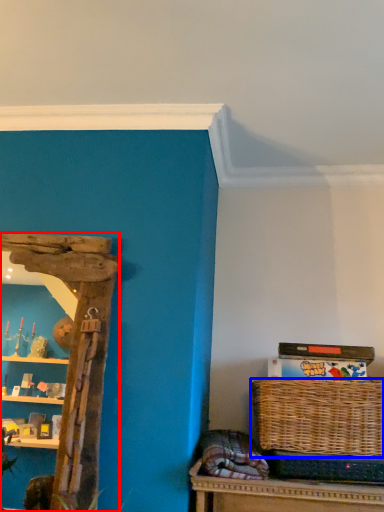
Question: Which of the following is the farthest to the observer, shelf (highlighted by a red box) or picnic basket (highlighted by a blue box)?

Choices:
 (A) shelf
 (B) picnic basket

Answer: (B)